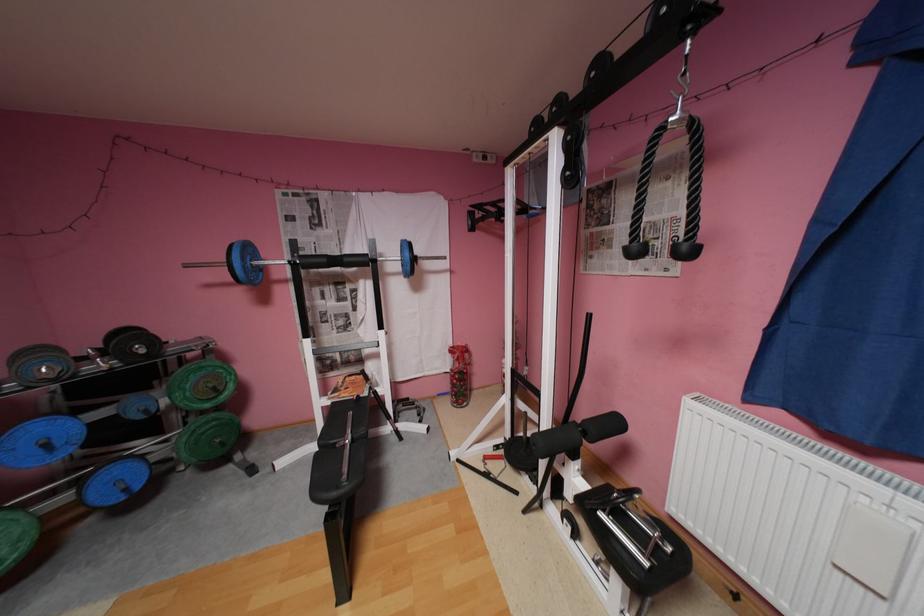
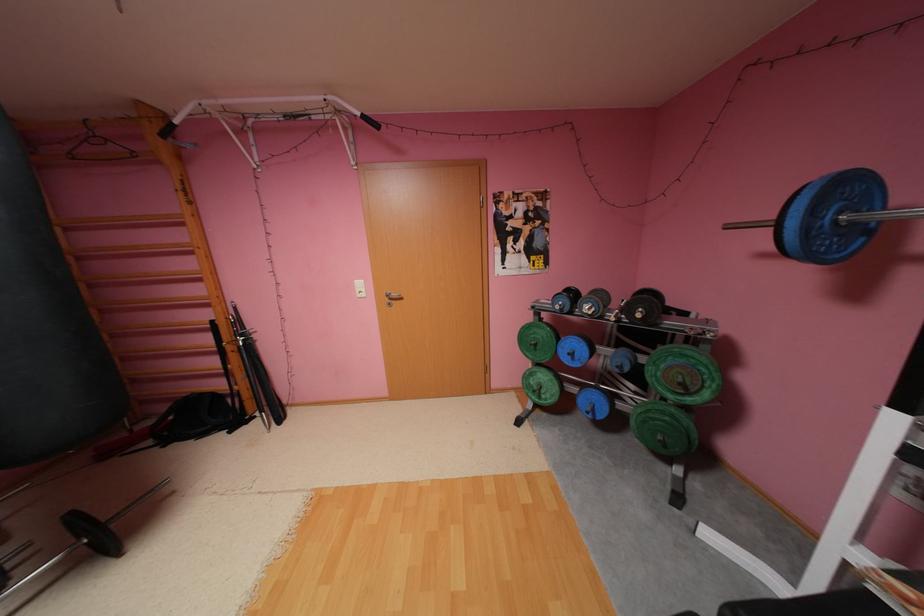
Find the pixel in the second image that matches (x=224, y=387) in the first image.

(690, 384)